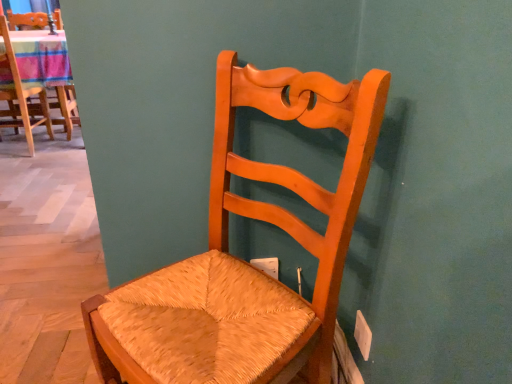
Question: In terms of size, does woven straw chair at upper left, which is the first chair in back-to-front order, appear bigger or smaller than matte wood chair at center, the first chair in the bottom-to-top sequence?

Choices:
 (A) small
 (B) big

Answer: (A)

Question: In terms of width, does woven straw chair at upper left, placed as the second chair when sorted from right to left, look wider or thinner when compared to matte wood chair at center, positioned as the 2th chair in back-to-front order?

Choices:
 (A) wide
 (B) thin

Answer: (B)

Question: Relative to matte wood chair at center, the 1th chair positioned from the right, is woven straw chair at upper left, positioned as the first chair in left-to-right order, in front or behind?

Choices:
 (A) behind
 (B) front

Answer: (A)

Question: Considering the relative positions of matte wood chair at center, the first chair in the bottom-to-top sequence, and woven straw chair at upper left, which is the first chair in back-to-front order, in the image provided, is matte wood chair at center, the first chair in the bottom-to-top sequence, to the left or to the right of woven straw chair at upper left, which is the first chair in back-to-front order,?

Choices:
 (A) right
 (B) left

Answer: (A)

Question: From a real-world perspective, relative to woven straw chair at upper left, positioned as the first chair in left-to-right order, is matte wood chair at center, positioned as the 2th chair in back-to-front order, vertically above or below?

Choices:
 (A) above
 (B) below

Answer: (B)

Question: From the image's perspective, relative to woven straw chair at upper left, placed as the second chair when sorted from right to left, is matte wood chair at center, the first chair in the bottom-to-top sequence, above or below?

Choices:
 (A) above
 (B) below

Answer: (B)

Question: Is point (345, 94) positioned closer to the camera than point (13, 79)?

Choices:
 (A) closer
 (B) farther

Answer: (A)